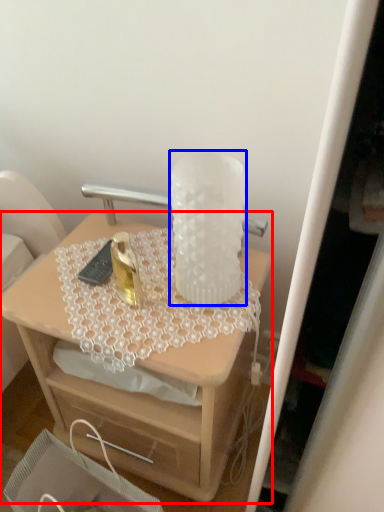
Question: Which of the following is the closest to the observer, desk (highlighted by a red box) or vase (highlighted by a blue box)?

Choices:
 (A) desk
 (B) vase

Answer: (B)